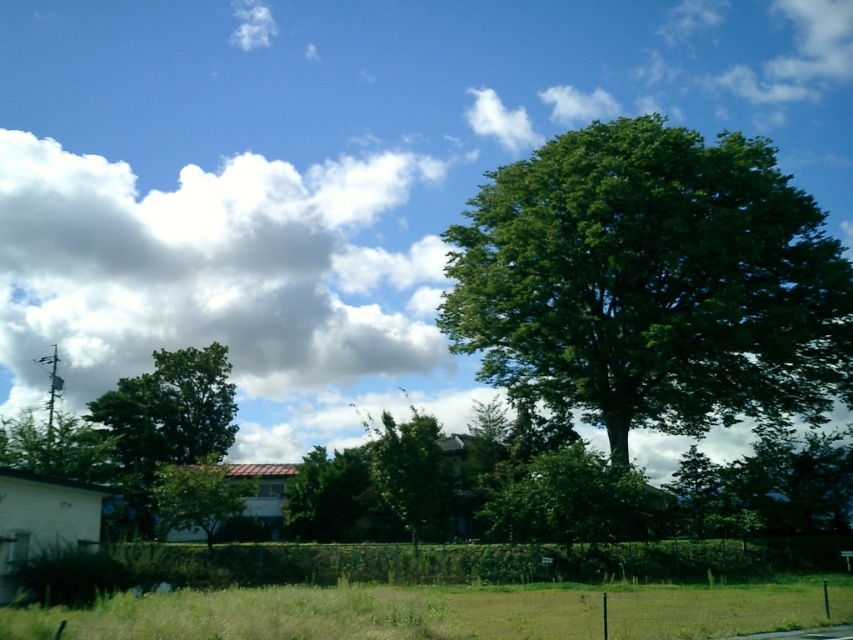
You are standing in the middle of the grassy area and want to walk towards the green leafy tree at right and the green leafy tree at lower left. Which tree will you reach first?

The green leafy tree at right is closer to you than the green leafy tree at lower left, so you will reach the green leafy tree at right first.

You are standing in the middle of the grassy area and looking towards the small building. Where is the white fluffy cloud at upper left located in relation to your position?

The white fluffy cloud at upper left is located in the upper left direction from your position.